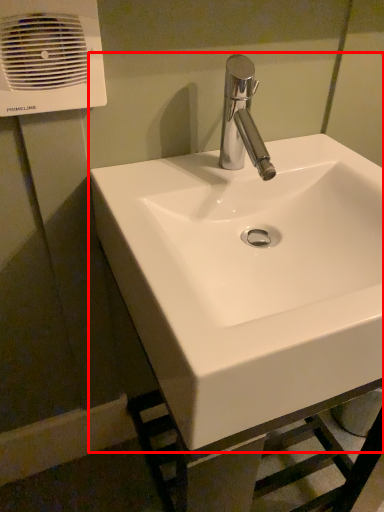
Question: In this image, where is sink (annotated by the red box) located relative to air conditioning?

Choices:
 (A) left
 (B) right

Answer: (B)